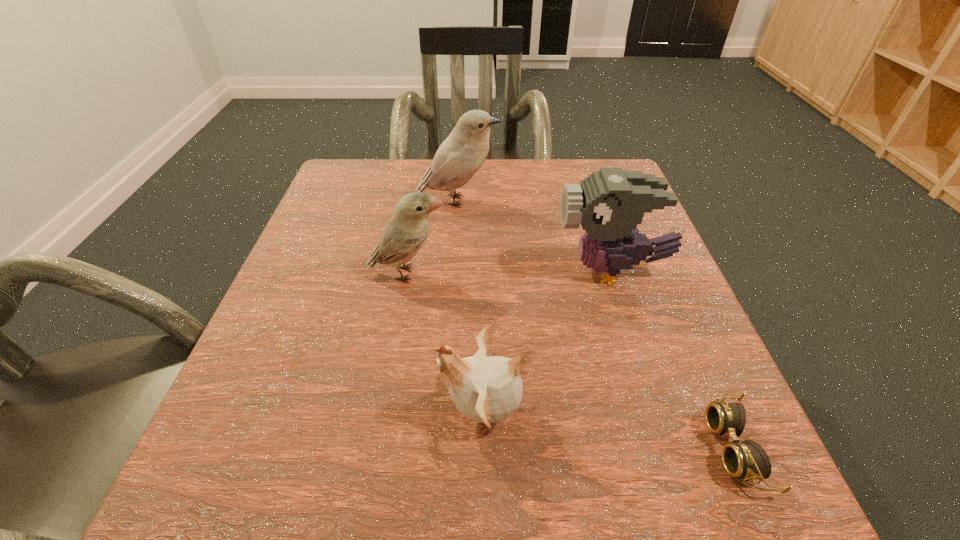
Identify the location of the farthest object. The width and height of the screenshot is (960, 540). (459, 157).

Identify the location of the rightmost bird. The image size is (960, 540). (609, 203).

You are a GUI agent. You are given a task and a screenshot of the screen. Output one action in this format:
    pyautogui.click(x=<x>, y=<y>)
    Task: Click on the nearest bird
    The height and width of the screenshot is (540, 960).
    Given the screenshot: What is the action you would take?
    pyautogui.click(x=487, y=389)

The image size is (960, 540). What are the coordinates of `the shortest bird` in the screenshot? It's located at (487, 389).

Locate an element on the screen. the shortest object is located at coordinates (747, 460).

What are the coordinates of `free location located 0.190m at the beak of the farthest object` in the screenshot? It's located at (584, 201).

This screenshot has height=540, width=960. In order to click on free spot located 0.260m at the beak of the rightmost bird in this screenshot , I will do `click(416, 271)`.

Where is `free space located at the beak of the rightmost bird`? This screenshot has width=960, height=540. free space located at the beak of the rightmost bird is located at coordinates (x=426, y=271).

This screenshot has width=960, height=540. Find the location of `vacant space located at the beak of the rightmost bird`. vacant space located at the beak of the rightmost bird is located at coordinates (485, 271).

The image size is (960, 540). Find the location of `vacant point located at the beak of the nearest bird`. vacant point located at the beak of the nearest bird is located at coordinates (236, 411).